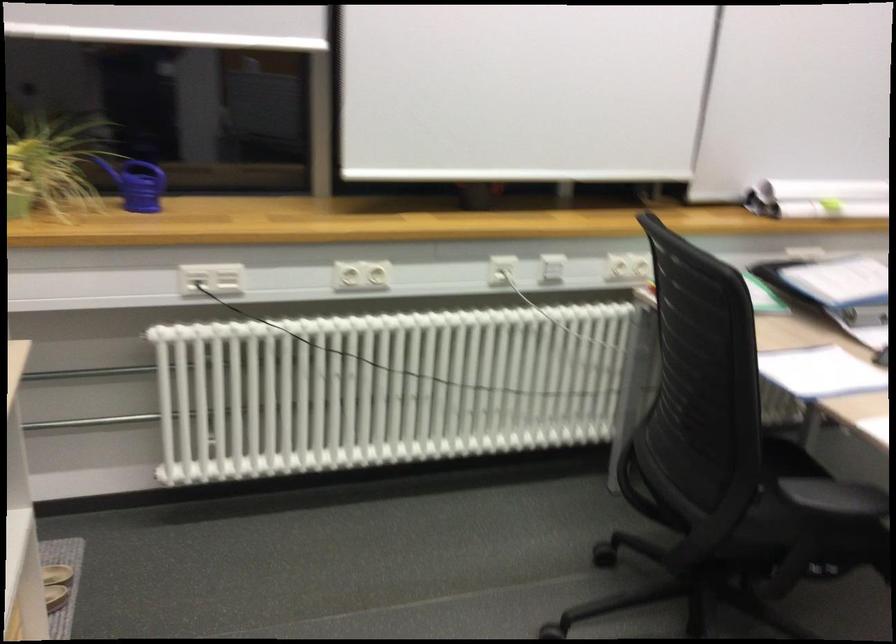
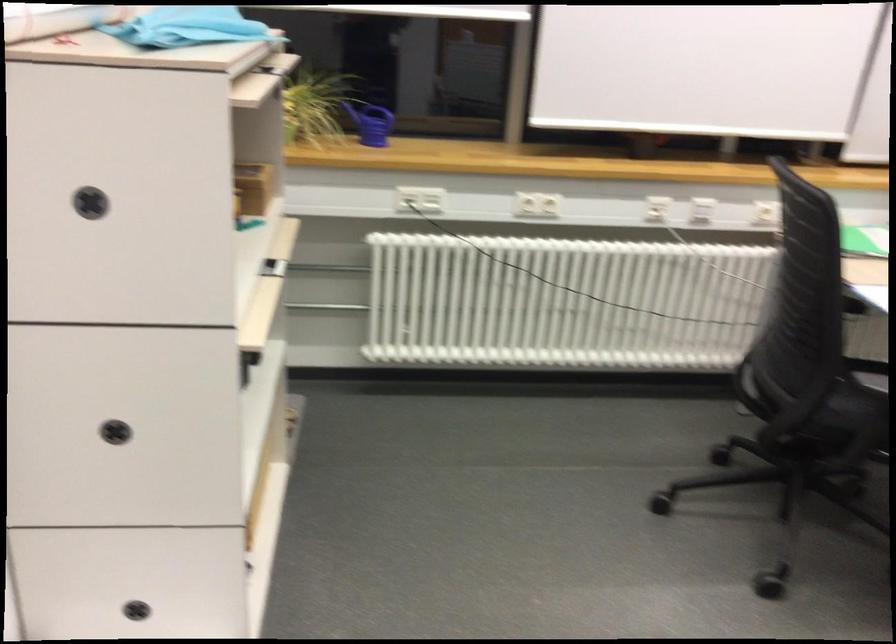
Question: What movement of the cameraman would produce the second image?

Choices:
 (A) Left
 (B) Right
 (C) Forward
 (D) Backward

Answer: (D)